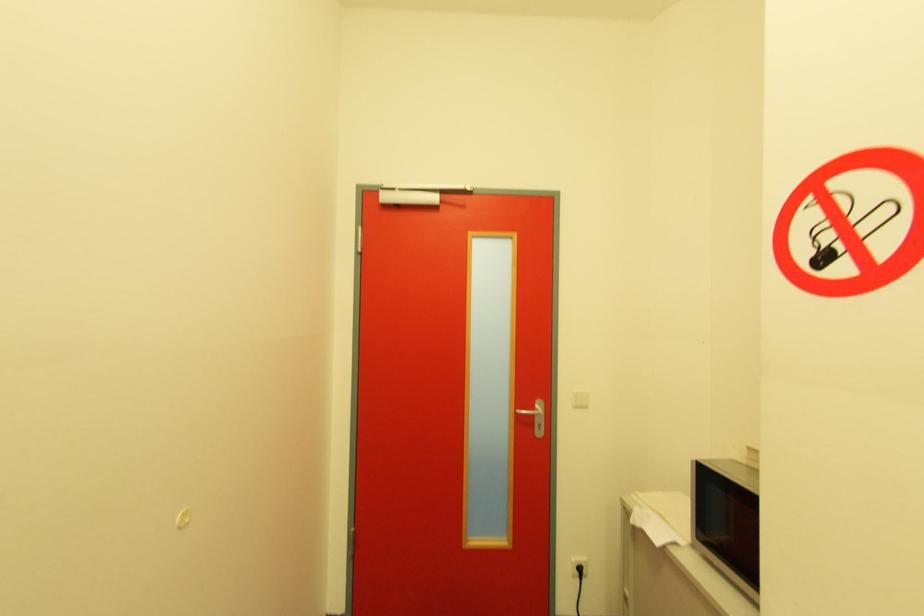
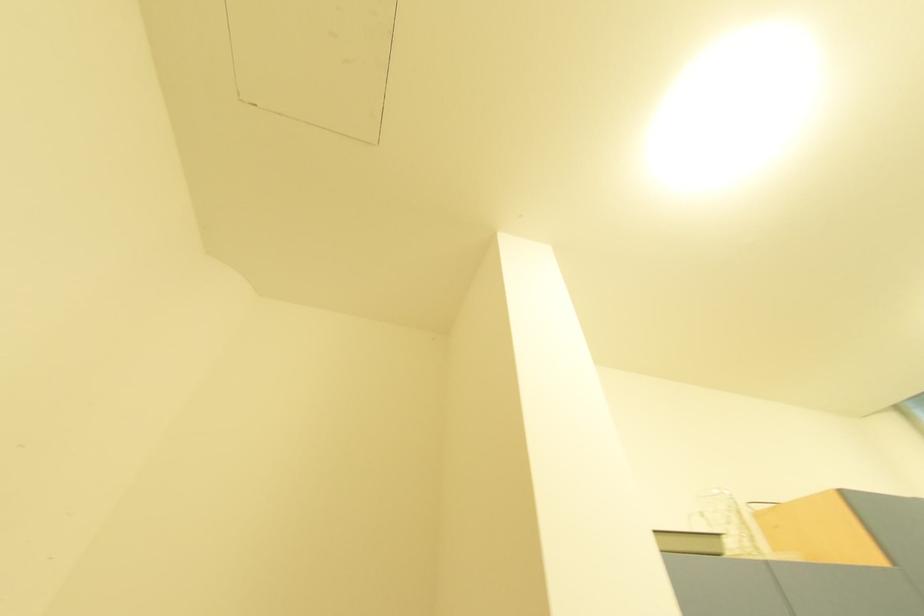
First-person continuous shooting, in which direction is the camera rotating?

The camera's rotation is toward right-up.